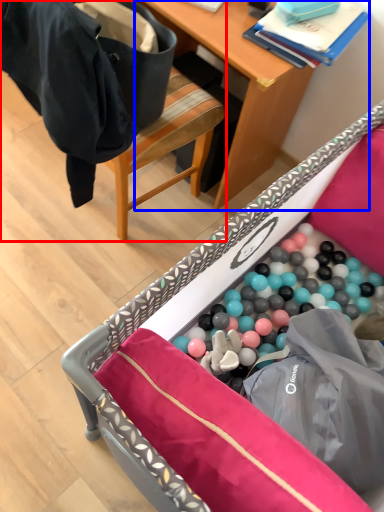
Question: Which object appears farthest to the camera in this image, chair (highlighted by a red box) or desk (highlighted by a blue box)?

Choices:
 (A) chair
 (B) desk

Answer: (B)